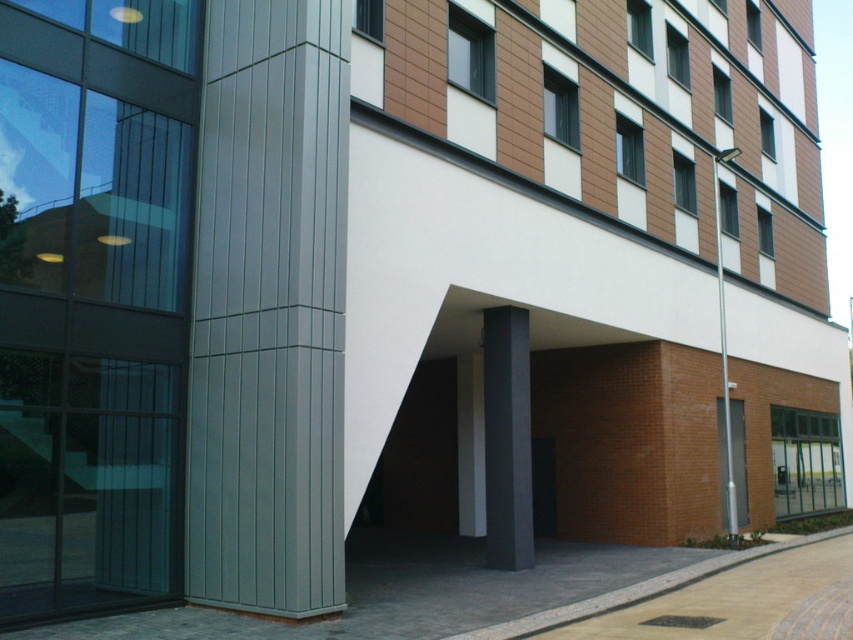
Question: Does silver metallic pole at right have a smaller size compared to black glass door at center?

Choices:
 (A) no
 (B) yes

Answer: (A)

Question: Does silver metallic pole at right come behind black glass door at center?

Choices:
 (A) yes
 (B) no

Answer: (A)

Question: Does silver metallic pole at right have a lesser width compared to black glass door at center?

Choices:
 (A) yes
 (B) no

Answer: (B)